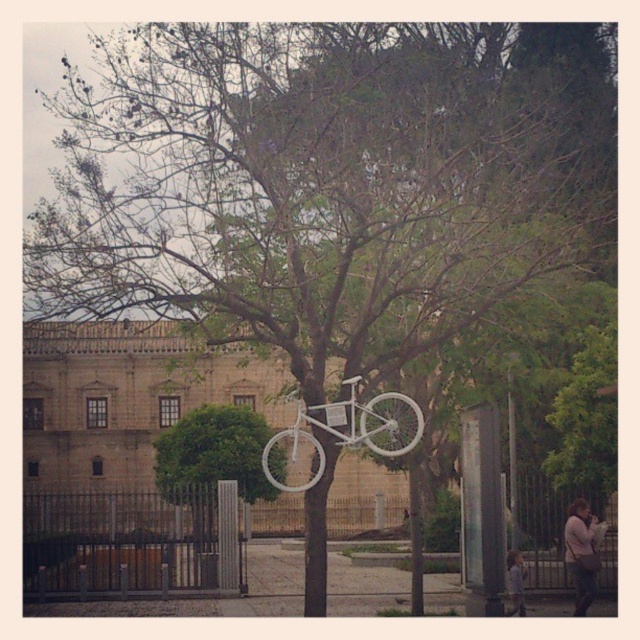
You are an artist planning to paint the scene. You want to emphasize the white matte bicycle at center and the metallic pole at center in your painting. Considering their sizes, which object should you make larger in your artwork to maintain the scene proportions?

The white matte bicycle at center has a larger size compared to the metallic pole at center, so in the artwork, the white matte bicycle at center should be painted larger to maintain the scene proportions.

You are standing at the point with coordinates (211, 460) in the image. What object is located exactly at that point?

The point at coordinates (211, 460) is occupied by the green leafy tree at center.

From the picture: You are an artist planning to paint the scene. You need to decide which object, the green leafy tree at center or the white matte bicycle at center, should be placed higher in your painting to maintain the scene proportions. According to the scene description, which object should be positioned higher?

The white matte bicycle at center should be positioned higher in the painting since the green leafy tree at center is not as tall as the white matte bicycle at center, meaning the bicycle is taller and should be placed higher to maintain proportions.